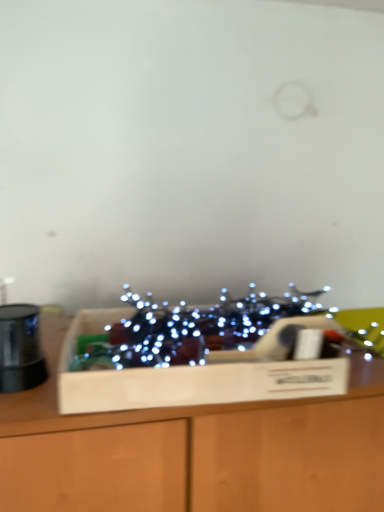
The image size is (384, 512). Describe the element at coordinates (195, 450) in the screenshot. I see `wooden box at center` at that location.

Describe the element at coordinates (190, 329) in the screenshot. I see `illuminated string lights at center` at that location.

At what (x,y) coordinates should I click in order to perform the action: click on illuminated string lights at center. Please return your answer as a coordinate pair (x, y). The width and height of the screenshot is (384, 512). Looking at the image, I should click on (190, 329).

Where is `wooden box at center`? This screenshot has height=512, width=384. wooden box at center is located at coordinates (195, 374).

The height and width of the screenshot is (512, 384). Identify the location of wooden box at center. (195, 450).

Would you say illuminated string lights at center is inside or outside wooden box at center?

illuminated string lights at center is outside wooden box at center.

Is illuminated string lights at center taller than wooden box at center?

No, illuminated string lights at center is not taller than wooden box at center.

Does illuminated string lights at center have a smaller size compared to wooden box at center?

Yes, illuminated string lights at center is smaller than wooden box at center.

Is the position of illuminated string lights at center less distant than that of wooden box at center?

No, illuminated string lights at center is further to the viewer.

Between wooden box at center and wooden box at center, which one appears on the left side from the viewer's perspective?

wooden box at center is more to the left.

Does wooden box at center lie behind wooden box at center?

No.

Are wooden box at center and wooden box at center making contact?

Absolutely, wooden box at center is next to and touching wooden box at center.

Is point (26, 504) positioned after point (262, 369)?

No, it is in front of (262, 369).

Between wooden box at center and illuminated string lights at center, which one has smaller width?

illuminated string lights at center.

Does wooden box at center have a smaller size compared to illuminated string lights at center?

Actually, wooden box at center might be larger than illuminated string lights at center.

Which is more to the right, wooden box at center or illuminated string lights at center?

illuminated string lights at center is more to the right.

From a real-world perspective, is wooden box at center on top of illuminated string lights at center?

Actually, wooden box at center is physically below illuminated string lights at center in the real world.

Image resolution: width=384 pixels, height=512 pixels. I want to click on table below the wooden box at center (from a real-world perspective), so click(x=195, y=450).

Based on the photo, in terms of size, does wooden box at center appear bigger or smaller than wooden box at center?

In the image, wooden box at center appears to be smaller than wooden box at center.

Are wooden box at center and wooden box at center making contact?

Indeed, wooden box at center and wooden box at center are beside each other and touching.

Looking at the image, does illuminated string lights at center seem bigger or smaller compared to wooden box at center?

Clearly, illuminated string lights at center is larger in size than wooden box at center.

Which is closer, (147, 349) or (118, 380)?

Point (147, 349) is positioned farther from the camera compared to point (118, 380).

Would you say wooden box at center is part of illuminated string lights at center's contents?

Definitely not — wooden box at center is not inside illuminated string lights at center.

Which of these two, illuminated string lights at center or wooden box at center, stands shorter?

Standing shorter between the two is wooden box at center.

Considering the relative sizes of wooden box at center and illuminated string lights at center in the image provided, is wooden box at center thinner than illuminated string lights at center?

Yes.

Considering the positions of point (96, 383) and point (172, 325), is point (96, 383) closer or farther from the camera than point (172, 325)?

Clearly, point (96, 383) is closer to the camera than point (172, 325).

Based on the photo, from a real-world perspective, between wooden box at center and illuminated string lights at center, who is vertically lower?

From a 3D spatial view, wooden box at center is below.

Is wooden box at center bigger than illuminated string lights at center?

Actually, wooden box at center might be smaller than illuminated string lights at center.

At what (x,y) coordinates should I click in order to perform the action: click on table that is on the left side of illuminated string lights at center. Please return your answer as a coordinate pair (x, y). This screenshot has height=512, width=384. Looking at the image, I should click on (195, 450).

The image size is (384, 512). I want to click on cardboard box that appears on the right of wooden box at center, so click(x=195, y=374).

Which object lies further to the anchor point wooden box at center, wooden box at center or illuminated string lights at center?

illuminated string lights at center lies further to wooden box at center than the other object.

Based on their spatial positions, is illuminated string lights at center or wooden box at center closer to wooden box at center?

The object closer to wooden box at center is wooden box at center.

When comparing their distances from wooden box at center, does illuminated string lights at center or wooden box at center seem further?

illuminated string lights at center is further to wooden box at center.

Estimate the real-world distances between objects in this image. Which object is closer to illuminated string lights at center, wooden box at center or wooden box at center?

wooden box at center lies closer to illuminated string lights at center than the other object.

Considering their positions, is wooden box at center positioned further to illuminated string lights at center than wooden box at center?

wooden box at center.

Looking at this image, from the image, which object appears to be farther from wooden box at center, wooden box at center or illuminated string lights at center?

illuminated string lights at center lies further to wooden box at center than the other object.

Locate an element on the screen. This screenshot has width=384, height=512. cardboard box between illuminated string lights at center and wooden box at center vertically is located at coordinates (195, 374).